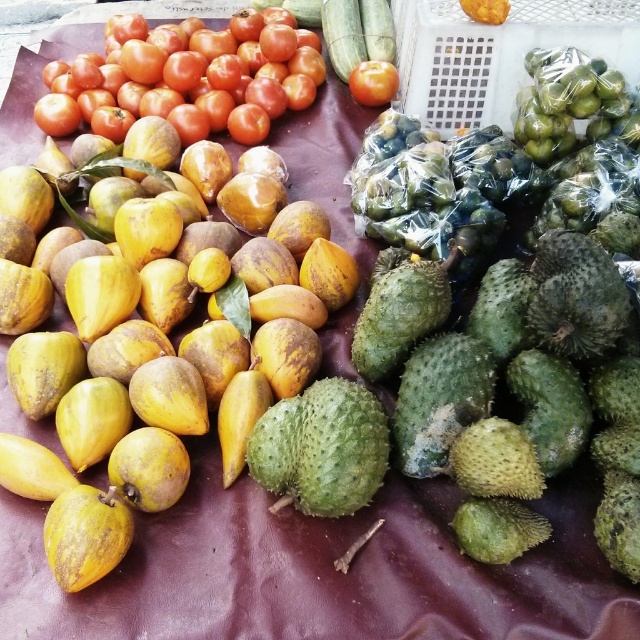
Question: Can you confirm if shiny red tomatoes at upper left is positioned to the right of shiny red tomato at upper center?

Choices:
 (A) yes
 (B) no

Answer: (B)

Question: Which is farther from the yellow matte fruit at left?

Choices:
 (A) shiny red tomatoes at upper left
 (B) shiny red tomato at upper center

Answer: (B)

Question: Which point is farther to the camera?

Choices:
 (A) (348, 83)
 (B) (221, 115)
 (C) (52, 266)

Answer: (A)

Question: Among these points, which one is nearest to the camera?

Choices:
 (A) (189, 116)
 (B) (156, 304)

Answer: (B)

Question: Does yellow matte fruit at left appear over shiny red tomatoes at upper left?

Choices:
 (A) no
 (B) yes

Answer: (A)

Question: Is shiny red tomatoes at upper left below shiny red tomato at upper center?

Choices:
 (A) no
 (B) yes

Answer: (A)